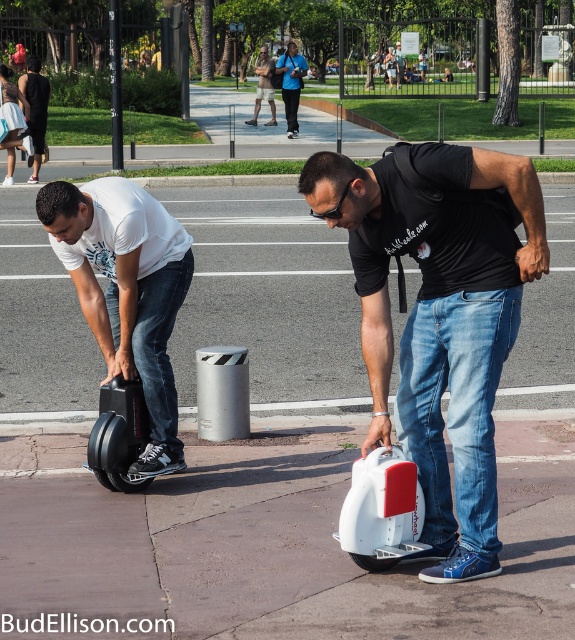
Question: Which object is positioned farthest from the black matte hoverboard at center?

Choices:
 (A) black matte scooter at lower left
 (B) smooth concrete sidewalk at center

Answer: (A)

Question: Does black matte hoverboard at left have a lesser width compared to black matte scooter at lower left?

Choices:
 (A) no
 (B) yes

Answer: (A)

Question: Which point is farther to the camera?

Choices:
 (A) (193, 198)
 (B) (109, 461)
 (C) (400, 44)
 (D) (285, 96)

Answer: (C)

Question: Which point appears farthest from the camera in this image?

Choices:
 (A) (386, 561)
 (B) (462, 348)
 (C) (394, 58)
 (D) (289, 70)

Answer: (C)

Question: Does smooth concrete sidewalk at center lie in front of blue fabric jacket at center?

Choices:
 (A) yes
 (B) no

Answer: (A)

Question: Can you confirm if black matte hoverboard at left is smaller than black matte hoverboard at center?

Choices:
 (A) no
 (B) yes

Answer: (A)